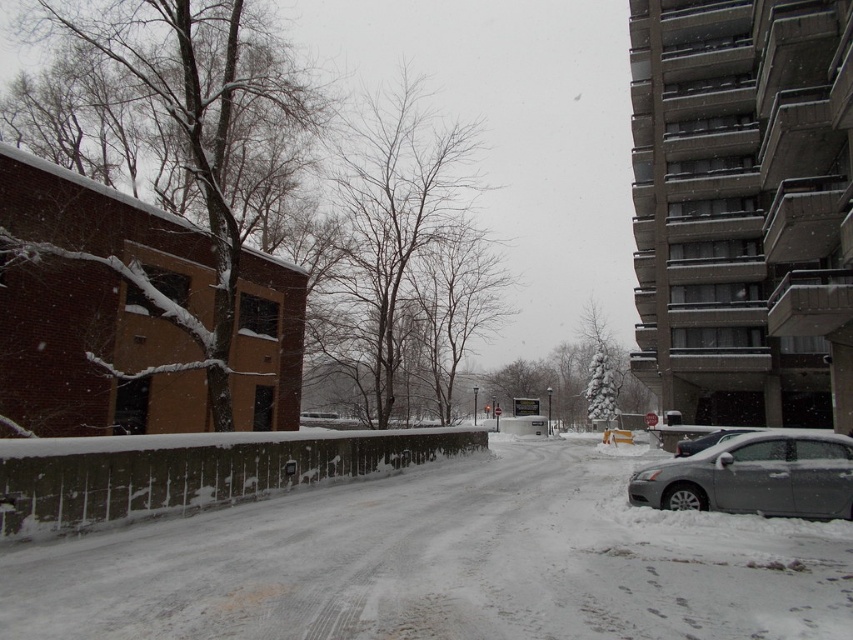
Question: Which point is closer to the camera?

Choices:
 (A) (744, 454)
 (B) (96, 568)

Answer: (B)

Question: Which point is closer to the camera?

Choices:
 (A) (805, 449)
 (B) (619, 493)

Answer: (A)

Question: Where is white powdery snow at center located in relation to sleek metallic sedan at right in the image?

Choices:
 (A) above
 (B) below

Answer: (B)

Question: Can you confirm if white powdery snow at center is positioned to the right of sleek metallic sedan at right?

Choices:
 (A) yes
 (B) no

Answer: (B)

Question: Does white powdery snow at center have a smaller size compared to sleek metallic sedan at right?

Choices:
 (A) no
 (B) yes

Answer: (A)